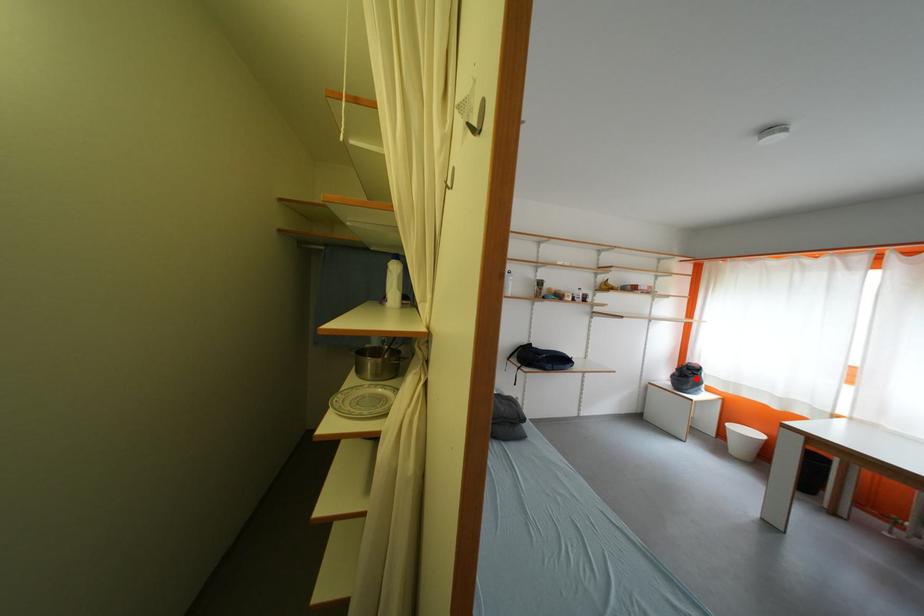
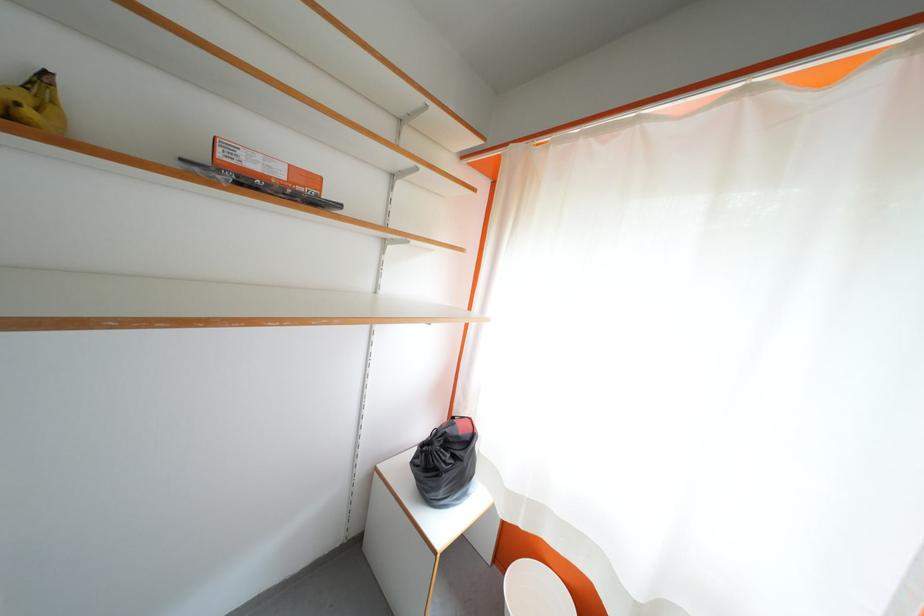
Locate, in the second image, the point that corresponds to the highlighted location in the first image.

(455, 460)